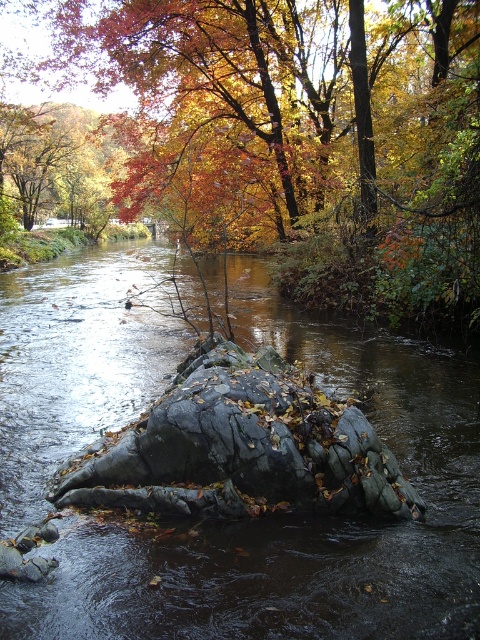
Which of these two, autumn leaves at center or black rock at center, stands taller?

autumn leaves at center

Where is `autumn leaves at center`? The height and width of the screenshot is (640, 480). autumn leaves at center is located at coordinates (276, 140).

Does autumn leaves at center have a lesser height compared to rough gray rock at center?

Incorrect, autumn leaves at center's height does not fall short of rough gray rock at center's.

Between point (339, 52) and point (266, 493), which one is positioned in front?

Point (266, 493) is more forward.

This screenshot has height=640, width=480. Describe the element at coordinates (276, 140) in the screenshot. I see `autumn leaves at center` at that location.

Find the location of a particular element. autumn leaves at center is located at coordinates (276, 140).

Which is more to the left, black rock at center or rough gray rock at center?

From the viewer's perspective, black rock at center appears more on the left side.

From the picture: Measure the distance from black rock at center to rough gray rock at center.

2.34 meters

Which is behind, point (168, 328) or point (201, 499)?

The point (168, 328) is behind.

What are the coordinates of `black rock at center` in the screenshot? It's located at click(x=297, y=515).